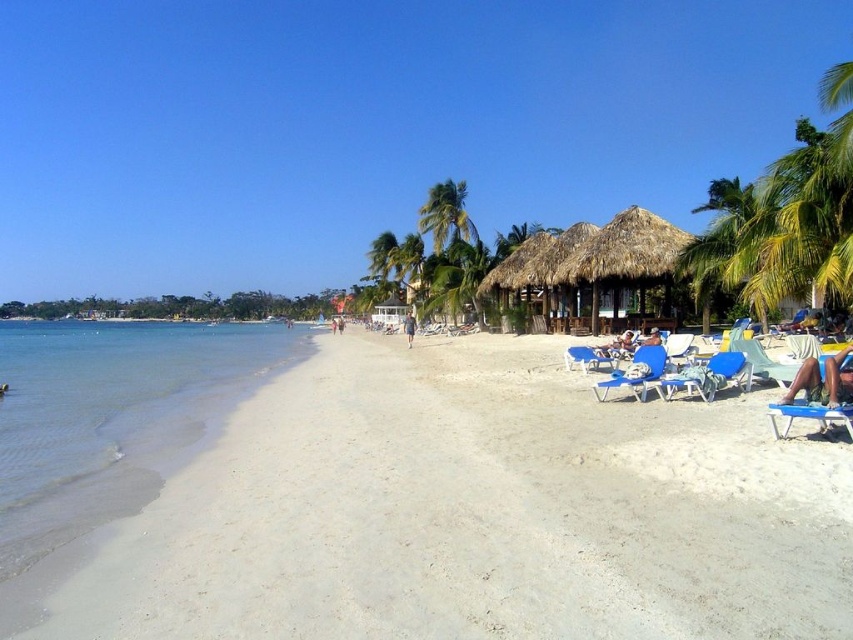
Question: Is green leafy palm tree at center to the right of light brown skin at center from the viewer's perspective?

Choices:
 (A) no
 (B) yes

Answer: (B)

Question: Considering the real-world distances, which object is closest to the thatched straw hut at center?

Choices:
 (A) tan skin person at lower right
 (B) green leafy palm tree at upper right
 (C) green leafy palm tree at center

Answer: (A)

Question: Can you confirm if blue plastic beach chair at lower right is smaller than blue fabric chair at center-right?

Choices:
 (A) no
 (B) yes

Answer: (B)

Question: Which point is closer to the camera?

Choices:
 (A) blue plastic beach chair at lower right
 (B) light blue fabric person at center

Answer: (A)

Question: Does white sand beach at lower left come behind brown leather bag at center?

Choices:
 (A) no
 (B) yes

Answer: (A)

Question: Among these points, which one is nearest to the camera?

Choices:
 (A) (645, 266)
 (B) (462, 228)

Answer: (A)